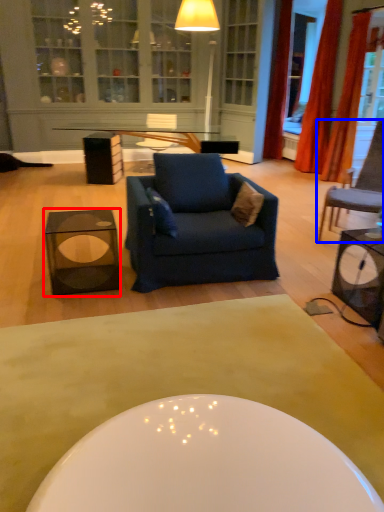
Question: Which object appears closest to the camera in this image, table (highlighted by a red box) or chair (highlighted by a blue box)?

Choices:
 (A) table
 (B) chair

Answer: (A)